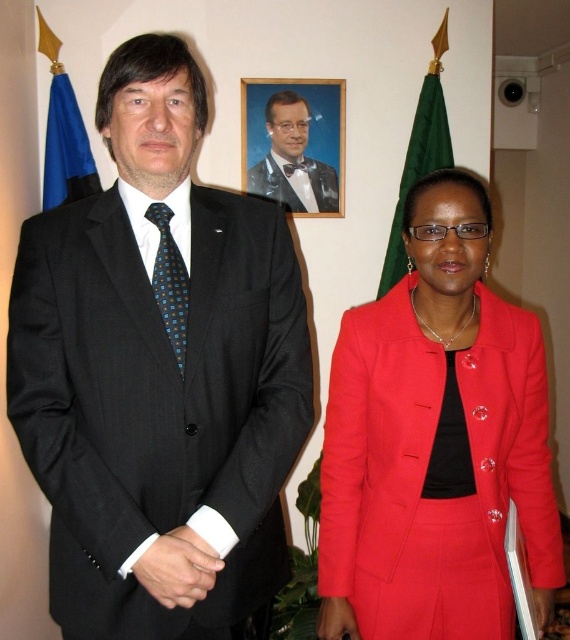
Question: Which is farther from the blue fabric flag at left?

Choices:
 (A) blue dotted tie at center
 (B) green fabric flag at upper center

Answer: (A)

Question: Among these objects, which one is farthest from the camera?

Choices:
 (A) matte red suit at center
 (B) black pinstripe suit at left
 (C) blue fabric flag at left
 (D) black satin tuxedo at center

Answer: (D)

Question: Which is farther from the metallic portrait at upper center?

Choices:
 (A) black satin tuxedo at center
 (B) matte red suit at center
 (C) blue fabric flag at left

Answer: (B)

Question: Considering the relative positions of blue fabric flag at left and black satin bow tie at center in the image provided, where is blue fabric flag at left located with respect to black satin bow tie at center?

Choices:
 (A) left
 (B) right

Answer: (A)

Question: Does matte red suit at center have a greater width compared to black satin bow tie at center?

Choices:
 (A) yes
 (B) no

Answer: (A)

Question: Does green fabric flag at upper center have a larger size compared to black satin tuxedo at center?

Choices:
 (A) no
 (B) yes

Answer: (B)